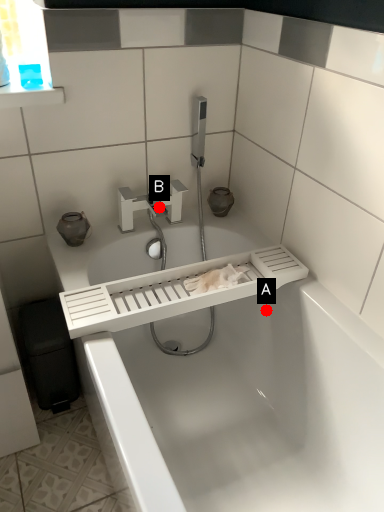
Question: Two points are circled on the image, labeled by A and B beside each circle. Which point is further to the camera?

Choices:
 (A) A is further
 (B) B is further

Answer: (B)